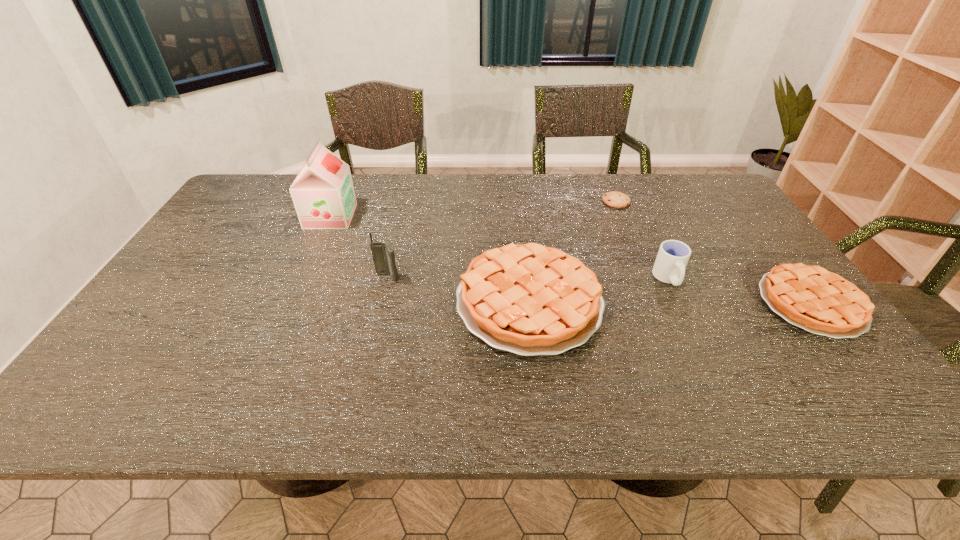
Where is `vacant region located on the right of the left pie`? vacant region located on the right of the left pie is located at coordinates (724, 301).

Image resolution: width=960 pixels, height=540 pixels. In order to click on vacant space situated 0.290m on the left of the shorter pie in this screenshot , I will do `click(648, 303)`.

At what (x,y) coordinates should I click in order to perform the action: click on vacant area situated 0.330m on the left of the shortest object. Please return your answer as a coordinate pair (x, y). Looking at the image, I should click on (504, 201).

Identify the location of vacant space situated with the handle on the side of the fourth shortest object. The image size is (960, 540). (701, 347).

Image resolution: width=960 pixels, height=540 pixels. What are the coordinates of `vacant space positioned 0.060m with the cap open on the leftmost object` in the screenshot? It's located at (372, 216).

Where is `vacant region located on the keyboard of the fifth shortest object`? vacant region located on the keyboard of the fifth shortest object is located at coordinates (371, 351).

You are a GUI agent. You are given a task and a screenshot of the screen. Output one action in this format:
    pyautogui.click(x=<x>, y=<y>)
    Task: Click on the cookie present at the far edge
    This screenshot has height=540, width=960.
    Given the screenshot: What is the action you would take?
    pyautogui.click(x=616, y=199)

Where is `soya milk at the far edge`? soya milk at the far edge is located at coordinates (323, 194).

Identify the location of object positioned at the right edge. Image resolution: width=960 pixels, height=540 pixels. (819, 301).

Identify the location of object that is at the near right corner. (819, 301).